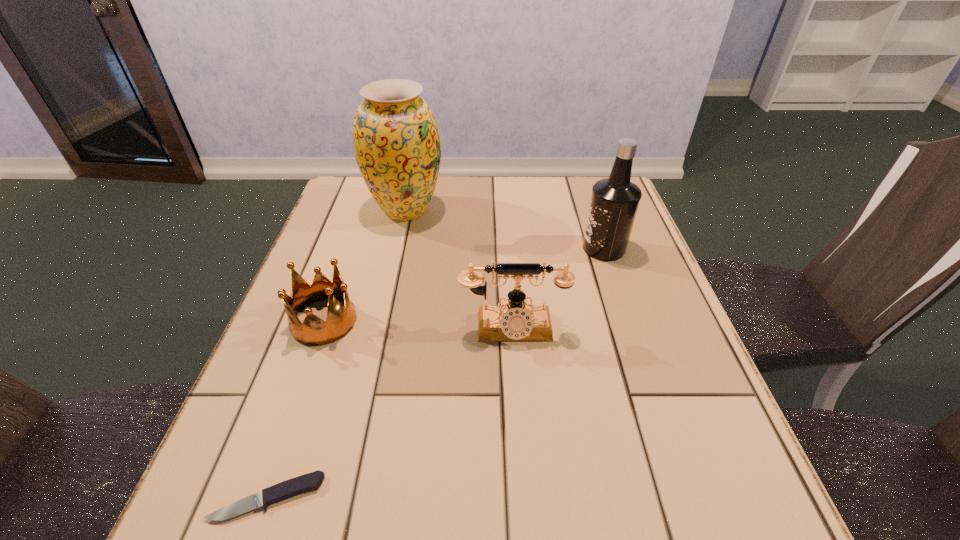
Locate an element on the screen. blank space located on the front label of the second tallest object is located at coordinates (443, 248).

Find the location of a particular element. This screenshot has width=960, height=540. vacant space located on the front label of the second tallest object is located at coordinates (422, 248).

Locate an element on the screen. The width and height of the screenshot is (960, 540). free region located on the dial of the second object from right to left is located at coordinates (518, 407).

At what (x,y) coordinates should I click in order to perform the action: click on vacant area situated on the back of the crown. Please return your answer as a coordinate pair (x, y). This screenshot has height=540, width=960. Looking at the image, I should click on (352, 240).

Where is `vacant space located 0.090m on the right of the nearest object`? vacant space located 0.090m on the right of the nearest object is located at coordinates (380, 497).

Identify the location of object that is at the far edge. The image size is (960, 540). (396, 141).

This screenshot has height=540, width=960. I want to click on object located in the near edge section of the desktop, so click(311, 481).

Locate an element on the screen. The height and width of the screenshot is (540, 960). vase that is at the left edge is located at coordinates (396, 141).

Image resolution: width=960 pixels, height=540 pixels. I want to click on crown present at the left edge, so click(314, 331).

In order to click on steak knife situated at the left edge in this screenshot , I will do `click(311, 481)`.